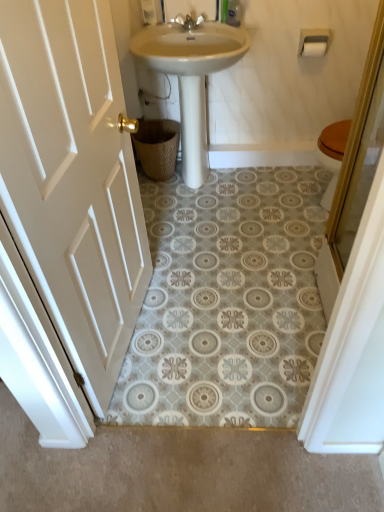
Question: Is silver metallic faucet at upper center in front of or behind white matte toilet paper at upper right in the image?

Choices:
 (A) front
 (B) behind

Answer: (A)

Question: From their relative heights in the image, would you say silver metallic faucet at upper center is taller or shorter than white matte toilet paper at upper right?

Choices:
 (A) short
 (B) tall

Answer: (B)

Question: Which object is positioned closest to the silver metallic faucet at upper center?

Choices:
 (A) white wood door at left
 (B) white glossy sink at center
 (C) clear plastic bottle at upper center
 (D) white plastic toilet paper holder at upper right
 (E) woven brown basket at lower center

Answer: (C)

Question: Which of these objects is positioned farthest from the white plastic toilet paper holder at upper right?

Choices:
 (A) silver metallic faucet at upper center
 (B) woven brown basket at lower center
 (C) white glossy sink at center
 (D) white matte toilet paper at upper right
 (E) white wood door at left

Answer: (E)